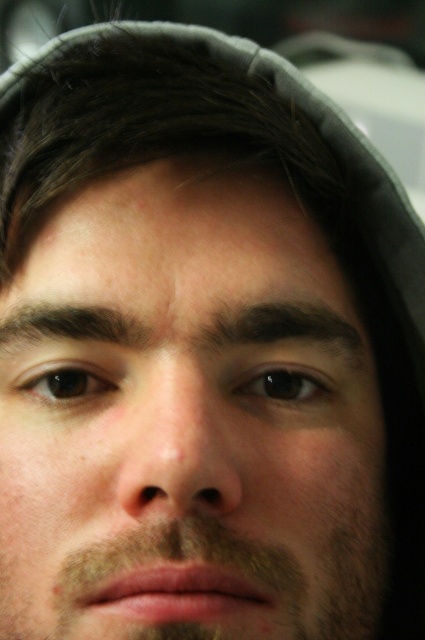
Question: Which point is closer to the camera?

Choices:
 (A) (328, 452)
 (B) (260, 520)

Answer: (B)

Question: Is smooth skin face at center positioned at the back of brown fuzzy beard at lower center?

Choices:
 (A) no
 (B) yes

Answer: (A)

Question: From the image, what is the correct spatial relationship of smooth skin face at center in relation to brown fuzzy beard at lower center?

Choices:
 (A) above
 (B) below

Answer: (A)

Question: Is smooth skin face at center positioned at the back of brown fuzzy beard at lower center?

Choices:
 (A) yes
 (B) no

Answer: (B)

Question: Which object appears closest to the camera in this image?

Choices:
 (A) smooth skin face at center
 (B) brown fuzzy beard at lower center

Answer: (A)